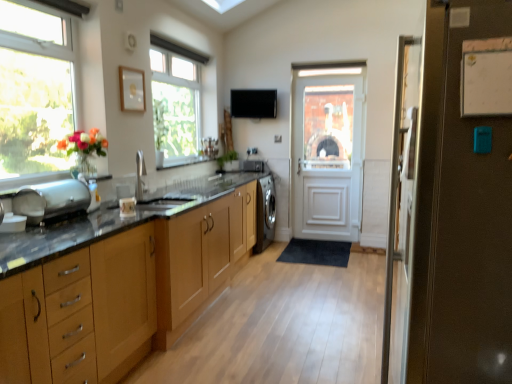
Question: Is white paper at upper right shorter than clear glass window at upper center, the first window when ordered from right to left?

Choices:
 (A) yes
 (B) no

Answer: (A)

Question: Does white paper at upper right have a greater width compared to clear glass window at upper center, the second window when ordered from left to right?

Choices:
 (A) yes
 (B) no

Answer: (B)

Question: Is white paper at upper right not near clear glass window at upper center, the 2th window when ordered from front to back?

Choices:
 (A) no
 (B) yes

Answer: (B)

Question: Is white paper at upper right positioned behind clear glass window at upper center, the second window when ordered from left to right?

Choices:
 (A) no
 (B) yes

Answer: (A)

Question: Does white paper at upper right have a greater height compared to clear glass window at upper center, the 2th window when ordered from front to back?

Choices:
 (A) yes
 (B) no

Answer: (B)

Question: Considering the relative sizes of white paper at upper right and clear glass window at upper center, the second window when ordered from left to right, in the image provided, is white paper at upper right thinner than clear glass window at upper center, the second window when ordered from left to right,?

Choices:
 (A) yes
 (B) no

Answer: (A)

Question: Is brown matte refrigerator at right, the 1th door when ordered from front to back, looking in the opposite direction of black matte exhaust hood at upper center?

Choices:
 (A) yes
 (B) no

Answer: (B)

Question: Is brown matte refrigerator at right, the 1th door when ordered from front to back, wider than black matte exhaust hood at upper center?

Choices:
 (A) no
 (B) yes

Answer: (B)

Question: Does brown matte refrigerator at right, the 1th door when ordered from front to back, have a lesser width compared to black matte exhaust hood at upper center?

Choices:
 (A) no
 (B) yes

Answer: (A)

Question: From a real-world perspective, is brown matte refrigerator at right, which is the 2th door in back-to-front order, below black matte exhaust hood at upper center?

Choices:
 (A) no
 (B) yes

Answer: (B)

Question: Does brown matte refrigerator at right, the 1th door when ordered from front to back, have a lesser height compared to black matte exhaust hood at upper center?

Choices:
 (A) no
 (B) yes

Answer: (A)

Question: Is brown matte refrigerator at right, which is the 2th door in back-to-front order, outside of black matte exhaust hood at upper center?

Choices:
 (A) no
 (B) yes

Answer: (B)

Question: Considering the relative positions of black matte exhaust hood at upper center and wooden cabinets at center, positioned as the first cabinetry in back-to-front order, in the image provided, is black matte exhaust hood at upper center behind wooden cabinets at center, positioned as the first cabinetry in back-to-front order,?

Choices:
 (A) no
 (B) yes

Answer: (B)